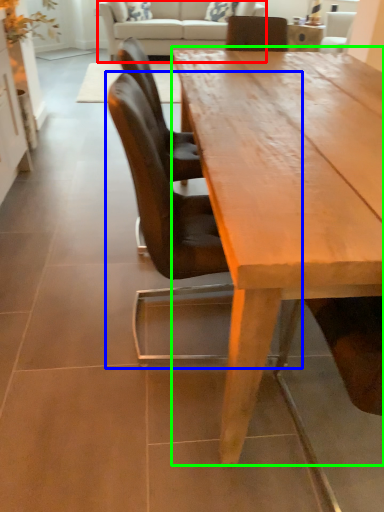
Question: Considering the real-world distances, which object is farthest from studio couch (highlighted by a red box)? chair (highlighted by a blue box) or coffee table (highlighted by a green box)?

Choices:
 (A) chair
 (B) coffee table

Answer: (A)